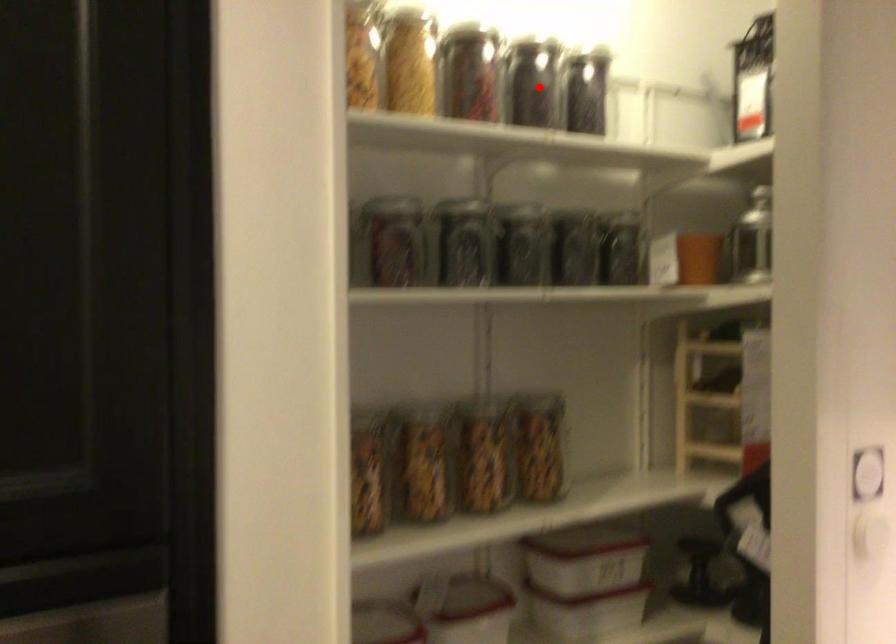
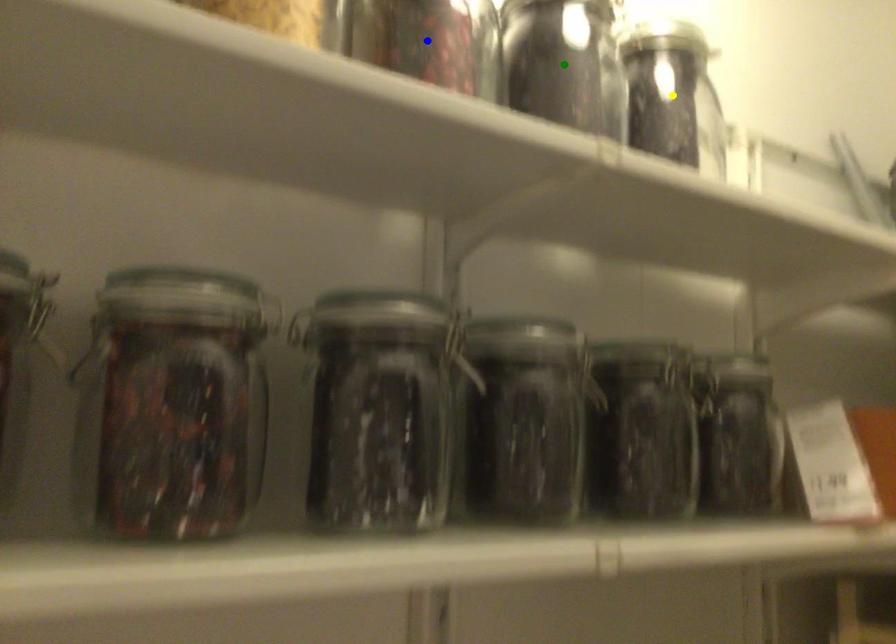
Question: I am providing you with two images of the same scene from different viewpoints. A red point is marked on the first image. You are given multiple points on the second image. In image 2, which mark is for the same physical point as the one in image 1?

Choices:
 (A) blue point
 (B) green point
 (C) yellow point

Answer: (B)